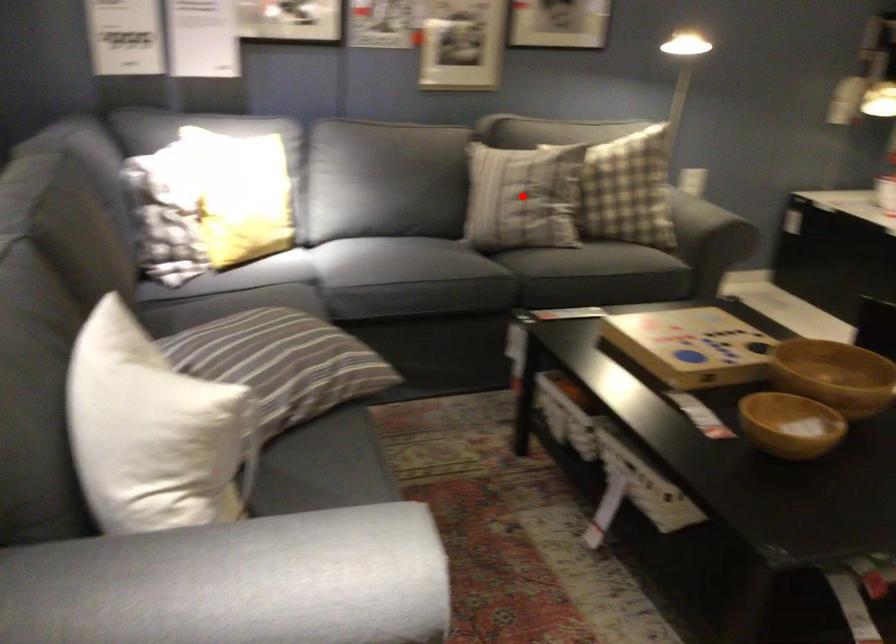
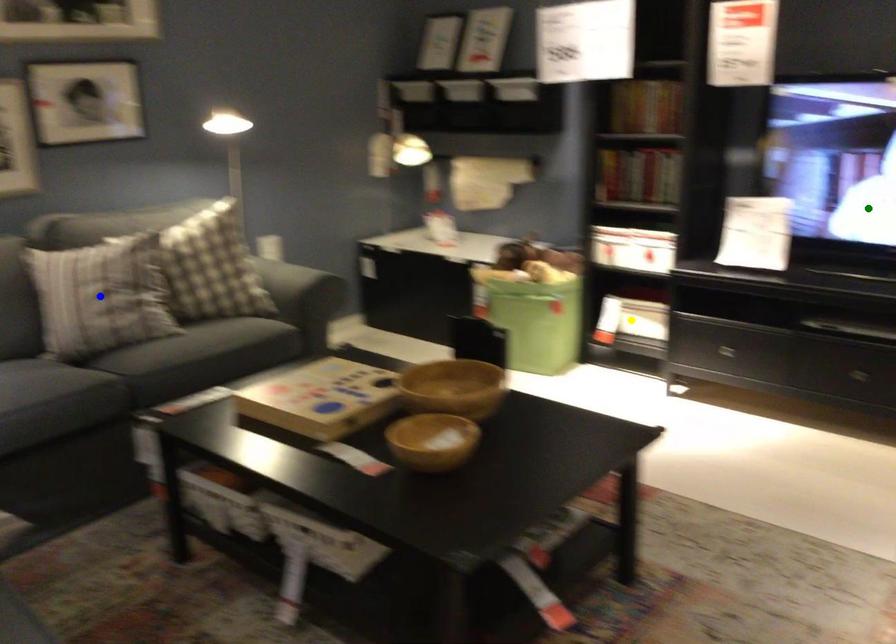
Question: I am providing you with two images of the same scene from different viewpoints. A red point is marked on the first image. You are given multiple points on the second image. Which spot in image 2 lines up with the point in image 1?

Choices:
 (A) green point
 (B) yellow point
 (C) blue point

Answer: (C)